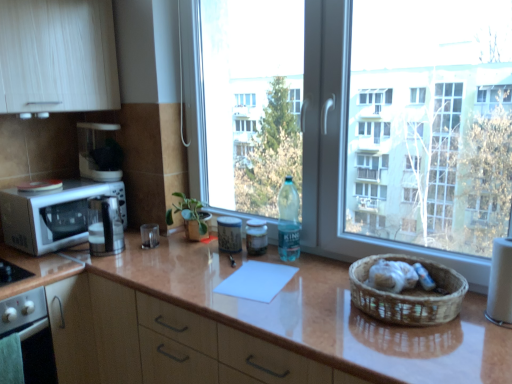
Image resolution: width=512 pixels, height=384 pixels. I want to click on vacant space that's between brown woven basket at right and matte glass jar at center, the 2th appliance positioned from the bottom, so click(x=308, y=278).